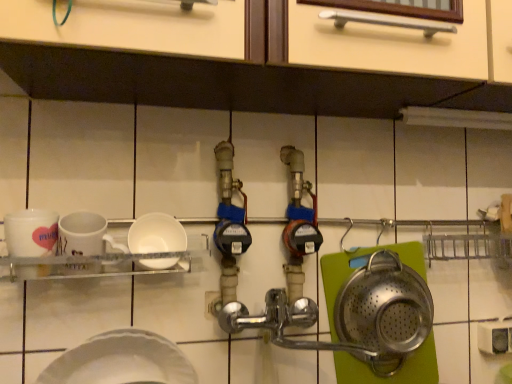
Measure the distance between point (161, 248) and camera.

A distance of 85.20 centimeters exists between point (161, 248) and camera.

Where is `white matte bowl at center, the first plate when ordered from top to bottom`? The width and height of the screenshot is (512, 384). white matte bowl at center, the first plate when ordered from top to bottom is located at coordinates (156, 234).

From a real-world perspective, is white matte plate at lower left, the 1th plate in the bottom-to-top sequence, beneath white glossy mug at left?

Correct, in the physical world, white matte plate at lower left, the 1th plate in the bottom-to-top sequence, is lower than white glossy mug at left.

Is white glossy mug at left at the back of white matte plate at lower left, the 1th plate in the bottom-to-top sequence?

No, white matte plate at lower left, the 1th plate in the bottom-to-top sequence,'s orientation is not away from white glossy mug at left.

Is white matte plate at lower left, the second plate in the top-to-bottom sequence, touching white glossy mug at left?

No, white matte plate at lower left, the second plate in the top-to-bottom sequence, is not touching white glossy mug at left.

Does point (133, 365) come behind point (44, 217)?

No, it is not.

Considering the sizes of objects white glossy mug at left and white matte plate at lower left, the second plate in the top-to-bottom sequence, in the image provided, who is smaller, white glossy mug at left or white matte plate at lower left, the second plate in the top-to-bottom sequence,?

white glossy mug at left.

From a real-world perspective, is white glossy mug at left positioned under white matte plate at lower left, the second plate in the top-to-bottom sequence, based on gravity?

Incorrect, from a real-world perspective, white glossy mug at left is higher than white matte plate at lower left, the second plate in the top-to-bottom sequence.

I want to click on coffee cup above the white matte plate at lower left, the second plate in the top-to-bottom sequence (from a real-world perspective), so pyautogui.click(x=29, y=242).

Does white glossy mug at left have a greater width compared to white matte plate at lower left, the second plate in the top-to-bottom sequence?

Incorrect, the width of white glossy mug at left does not surpass that of white matte plate at lower left, the second plate in the top-to-bottom sequence.

Considering the sizes of objects white glossy mug at left and white matte bowl at center, the first plate when ordered from top to bottom, in the image provided, who is thinner, white glossy mug at left or white matte bowl at center, the first plate when ordered from top to bottom,?

white glossy mug at left is thinner.

Is point (34, 224) positioned behind point (178, 228)?

No.

In the scene shown: From a real-world perspective, which object stands above the other?

In real-world perspective, white glossy mug at left is above.

From a real-world perspective, which object rests below the other?

white matte plate at lower left, the 1th plate in the bottom-to-top sequence.

Is white matte bowl at center, which is the 2th plate from bottom to top, wider than white matte plate at lower left, the second plate in the top-to-bottom sequence?

In fact, white matte bowl at center, which is the 2th plate from bottom to top, might be narrower than white matte plate at lower left, the second plate in the top-to-bottom sequence.

The image size is (512, 384). I want to click on plate above the white matte plate at lower left, the second plate in the top-to-bottom sequence (from a real-world perspective), so click(156, 234).

Who is more distant, white matte bowl at center, the first plate when ordered from top to bottom, or white matte plate at lower left, the 1th plate in the bottom-to-top sequence?

white matte bowl at center, the first plate when ordered from top to bottom, is further away from the camera.

Is point (158, 221) positioned behind point (30, 211)?

Yes, it is behind point (30, 211).

Looking at their sizes, would you say white matte bowl at center, which is the 2th plate from bottom to top, is wider or thinner than white glossy mug at left?

In the image, white matte bowl at center, which is the 2th plate from bottom to top, appears to be wider than white glossy mug at left.

From the image's perspective, relative to white glossy mug at left, is white matte bowl at center, which is the 2th plate from bottom to top, above or below?

From the image's perspective, white matte bowl at center, which is the 2th plate from bottom to top, appears below white glossy mug at left.

Where is `plate that is the 1st one below the white glossy mug at left (from a real-world perspective)`? This screenshot has height=384, width=512. plate that is the 1st one below the white glossy mug at left (from a real-world perspective) is located at coordinates (156, 234).

Is point (79, 361) closer or farther from the camera than point (148, 262)?

Point (79, 361).

From a real-world perspective, is white matte plate at lower left, the 1th plate in the bottom-to-top sequence, physically located above or below white matte bowl at center, the first plate when ordered from top to bottom?

In terms of real-world spatial position, white matte plate at lower left, the 1th plate in the bottom-to-top sequence, is below white matte bowl at center, the first plate when ordered from top to bottom.

Is white matte plate at lower left, the 1th plate in the bottom-to-top sequence, oriented towards white matte bowl at center, which is the 2th plate from bottom to top?

No, white matte plate at lower left, the 1th plate in the bottom-to-top sequence, is not aimed at white matte bowl at center, which is the 2th plate from bottom to top.

This screenshot has width=512, height=384. Identify the location of plate that is the 1st object to the right of the white glossy mug at left, starting at the anchor. (121, 361).

Find the location of a particular element. The width and height of the screenshot is (512, 384). coffee cup on the left of white matte plate at lower left, the second plate in the top-to-bottom sequence is located at coordinates (29, 242).

Which object lies further to the anchor point white matte bowl at center, the first plate when ordered from top to bottom, white matte plate at lower left, the second plate in the top-to-bottom sequence, or white glossy mug at left?

white matte plate at lower left, the second plate in the top-to-bottom sequence, is further to white matte bowl at center, the first plate when ordered from top to bottom.

When comparing their distances from white matte bowl at center, which is the 2th plate from bottom to top, does white glossy mug at left or white matte plate at lower left, the second plate in the top-to-bottom sequence, seem further?

white matte plate at lower left, the second plate in the top-to-bottom sequence, lies further to white matte bowl at center, which is the 2th plate from bottom to top, than the other object.

From the image, which object appears to be nearer to white matte plate at lower left, the 1th plate in the bottom-to-top sequence, white matte bowl at center, the first plate when ordered from top to bottom, or white glossy mug at left?

The object closer to white matte plate at lower left, the 1th plate in the bottom-to-top sequence, is white matte bowl at center, the first plate when ordered from top to bottom.

Looking at this image, estimate the real-world distances between objects in this image. Which object is further from white glossy mug at left, white matte bowl at center, which is the 2th plate from bottom to top, or white matte plate at lower left, the second plate in the top-to-bottom sequence?

white matte plate at lower left, the second plate in the top-to-bottom sequence, is further to white glossy mug at left.

Estimate the real-world distances between objects in this image. Which object is closer to white matte plate at lower left, the 1th plate in the bottom-to-top sequence, white glossy mug at left or white matte bowl at center, which is the 2th plate from bottom to top?

white matte bowl at center, which is the 2th plate from bottom to top.

Consider the image. Which object lies further to the anchor point white glossy mug at left, white matte plate at lower left, the second plate in the top-to-bottom sequence, or white matte bowl at center, the first plate when ordered from top to bottom?

white matte plate at lower left, the second plate in the top-to-bottom sequence, lies further to white glossy mug at left than the other object.

Where is `plate between white glossy mug at left and white matte plate at lower left, the second plate in the top-to-bottom sequence, vertically`? This screenshot has height=384, width=512. plate between white glossy mug at left and white matte plate at lower left, the second plate in the top-to-bottom sequence, vertically is located at coordinates (156, 234).